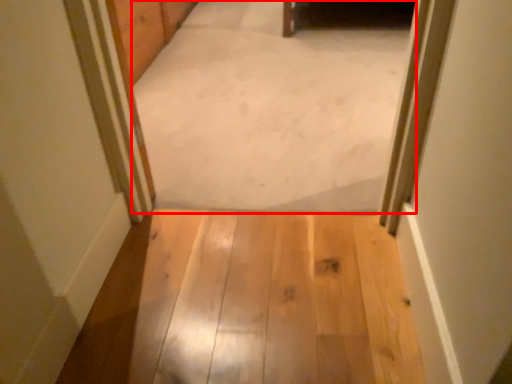
Question: From the image's perspective, where is passage (annotated by the red box) located relative to path?

Choices:
 (A) below
 (B) above

Answer: (B)